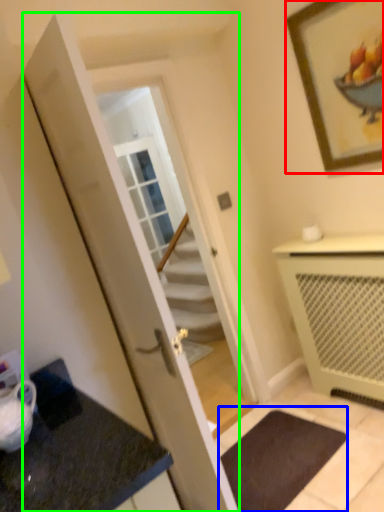
Question: Which is farther away from picture frame (highlighted by a red box)? bath mat (highlighted by a blue box) or door (highlighted by a green box)?

Choices:
 (A) bath mat
 (B) door

Answer: (A)